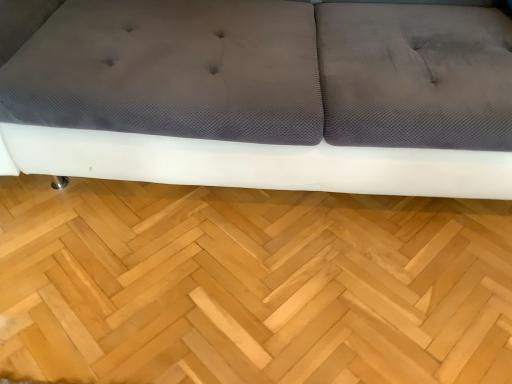
Question: Can you confirm if matte gray fabric couch at center is positioned to the left of natural wood floor at center?

Choices:
 (A) no
 (B) yes

Answer: (A)

Question: From the image's perspective, is matte gray fabric couch at center located above natural wood floor at center?

Choices:
 (A) no
 (B) yes

Answer: (B)

Question: Is matte gray fabric couch at center to the right of natural wood floor at center from the viewer's perspective?

Choices:
 (A) no
 (B) yes

Answer: (B)

Question: Is matte gray fabric couch at center wider than natural wood floor at center?

Choices:
 (A) yes
 (B) no

Answer: (A)

Question: Is matte gray fabric couch at center far away from natural wood floor at center?

Choices:
 (A) yes
 (B) no

Answer: (B)

Question: Is matte gray fabric couch at center oriented towards natural wood floor at center?

Choices:
 (A) no
 (B) yes

Answer: (B)

Question: Is natural wood floor at center not within matte gray fabric couch at center?

Choices:
 (A) yes
 (B) no

Answer: (A)

Question: Can you confirm if natural wood floor at center is shorter than matte gray fabric couch at center?

Choices:
 (A) yes
 (B) no

Answer: (A)

Question: From a real-world perspective, is natural wood floor at center located higher than matte gray fabric couch at center?

Choices:
 (A) no
 (B) yes

Answer: (A)

Question: From the image's perspective, is natural wood floor at center over matte gray fabric couch at center?

Choices:
 (A) yes
 (B) no

Answer: (B)

Question: Can you confirm if natural wood floor at center is bigger than matte gray fabric couch at center?

Choices:
 (A) no
 (B) yes

Answer: (A)

Question: Does natural wood floor at center have a smaller size compared to matte gray fabric couch at center?

Choices:
 (A) no
 (B) yes

Answer: (B)

Question: From the image's perspective, is natural wood floor at center positioned above or below matte gray fabric couch at center?

Choices:
 (A) below
 (B) above

Answer: (A)